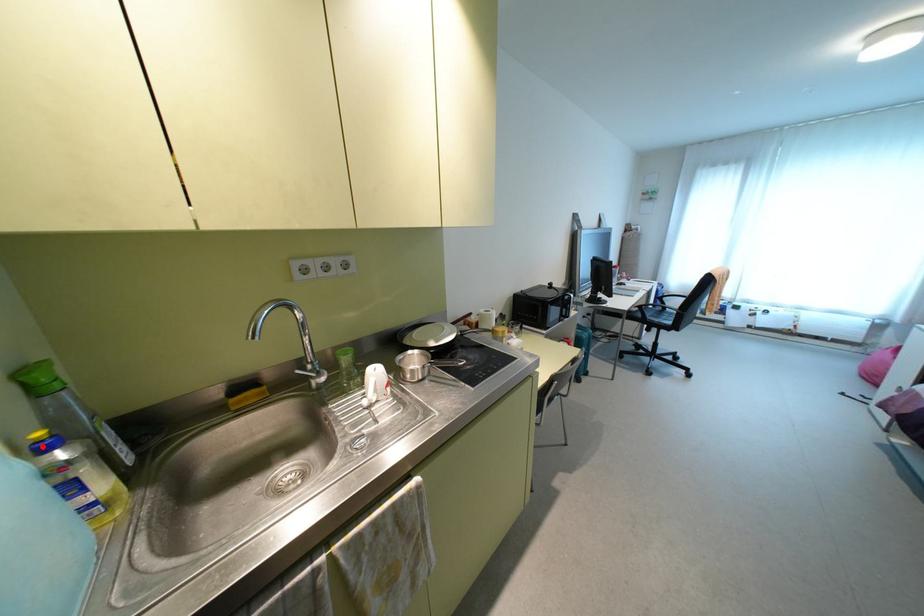
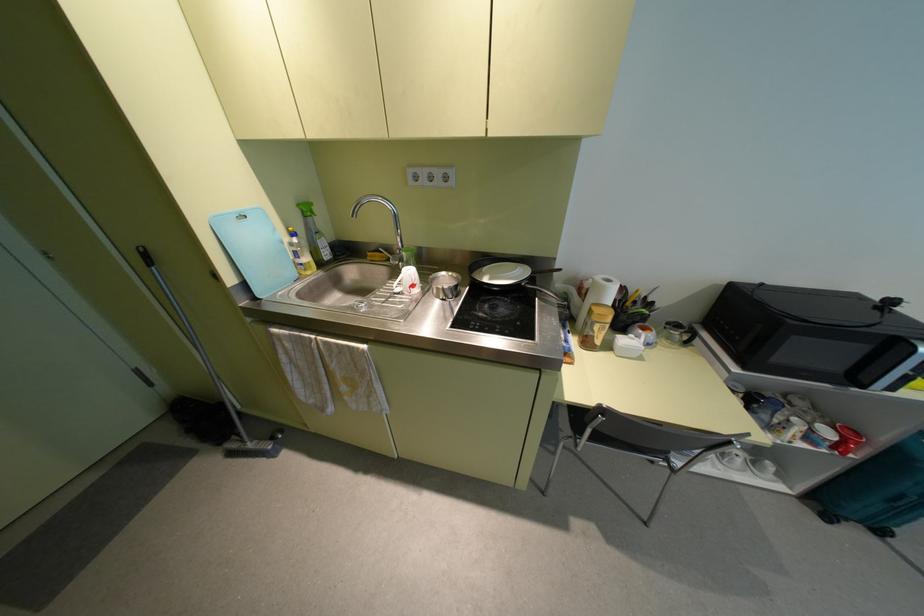
The point at the highlighted location is marked in the first image. Where is the corresponding point in the second image?

(293, 233)